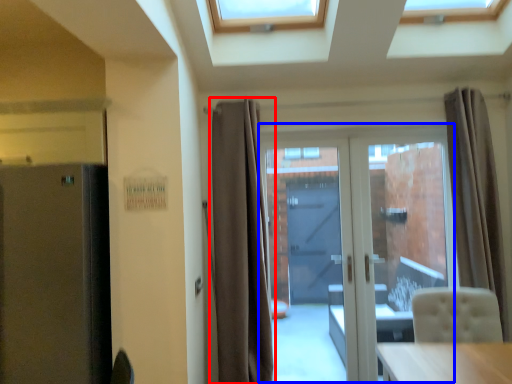
Question: Among these objects, which one is nearest to the camera, curtain (highlighted by a red box) or door (highlighted by a blue box)?

Choices:
 (A) curtain
 (B) door

Answer: (A)